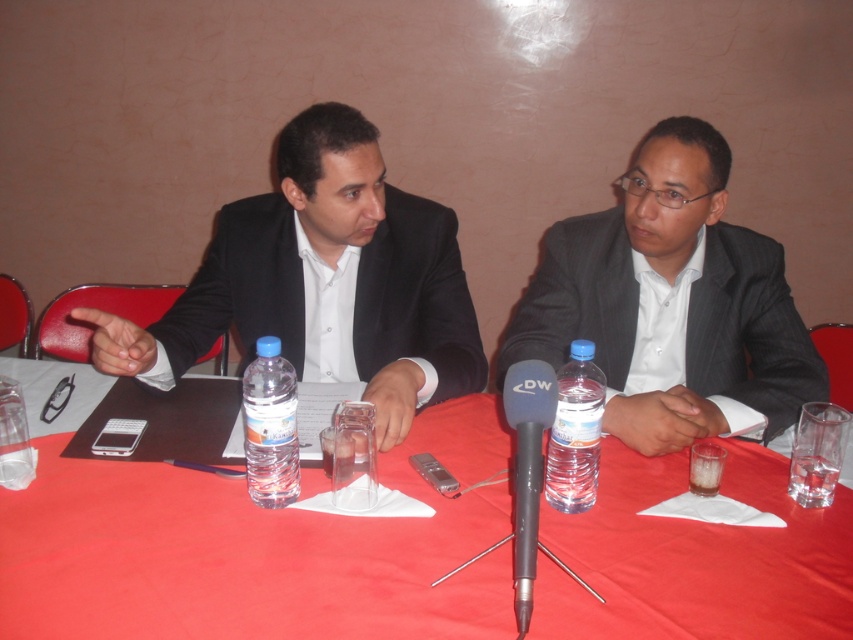
What are the coordinates of the red cloth table at center?

The red cloth table at center is located at coordinates point (257,548).

You are a photographer standing in front of the scene described. You need to adjust your camera to focus on the black matte suit at left. What is the minimum distance you should set your camera focus to ensure the suit is in clear view?

The minimum distance to set the camera focus should be 1.20 meters to ensure the black matte suit at left is in clear view.

You are a photographer positioned behind the table. You want to place a camera on the table between the red cloth table at center and the clear plastic bottle at center. Is there enough space for the camera if it requires 12 inches of space?

The red cloth table at center and clear plastic bottle at center are 10.35 inches apart, so there is not enough space to place the camera requiring 12 inches between them.